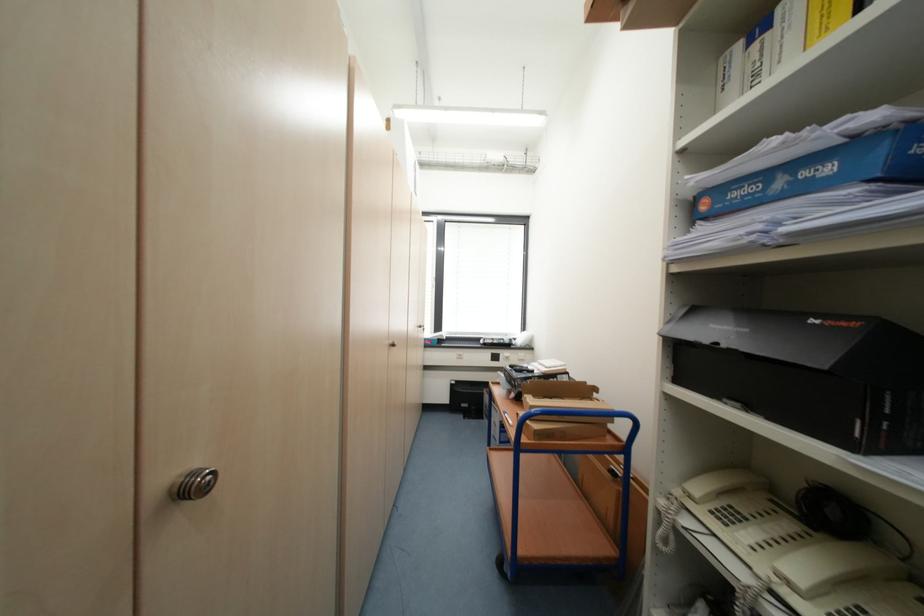
What do you see at coordinates (747, 507) in the screenshot? I see `the telephone keypad buttons` at bounding box center [747, 507].